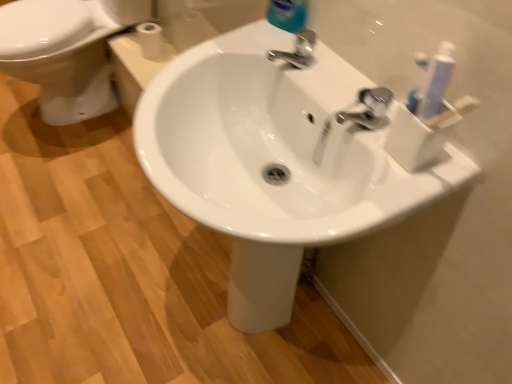
Find the location of a particular element. The height and width of the screenshot is (384, 512). vacant space situated on the left part of polished chrome faucet at upper right, which is the 2th tap from left to right is located at coordinates (307, 82).